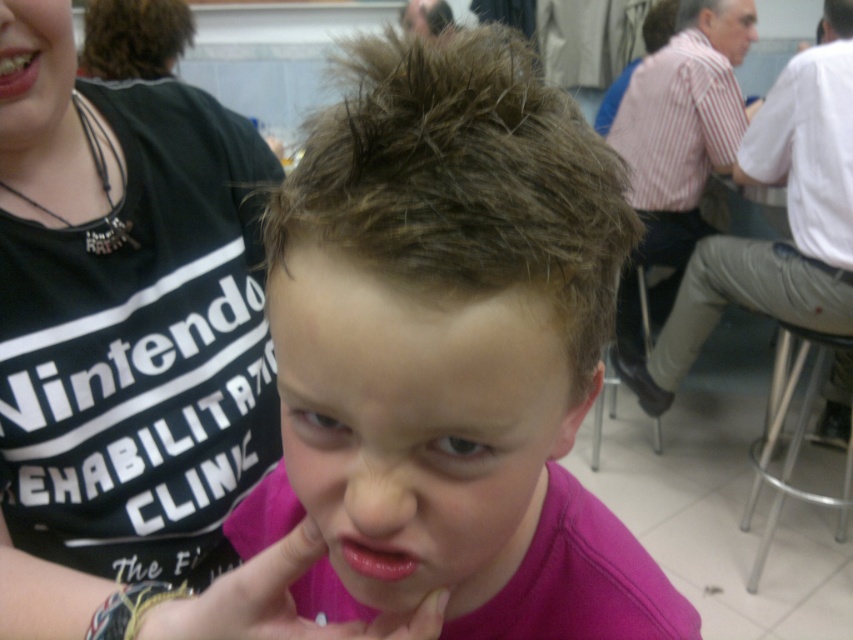
Question: Which object appears farthest from the camera in this image?

Choices:
 (A) matte black shirt at upper center
 (B) teeth glossy at upper left

Answer: (A)

Question: Is pink matte lips at center below teeth glossy at upper left?

Choices:
 (A) yes
 (B) no

Answer: (A)

Question: Which point is closer to the camera taking this photo?

Choices:
 (A) (165, 24)
 (B) (734, 60)

Answer: (A)

Question: Which of these objects is positioned farthest from the pink matte lips at center?

Choices:
 (A) silver metallic stool at lower right
 (B) teethsmoothtooth at upper left

Answer: (A)

Question: Is silver metallic stool at lower right to the right of teeth glossy at upper left from the viewer's perspective?

Choices:
 (A) no
 (B) yes

Answer: (B)

Question: Does pink matte hair at center appear on the right side of teeth glossy at upper left?

Choices:
 (A) no
 (B) yes

Answer: (B)